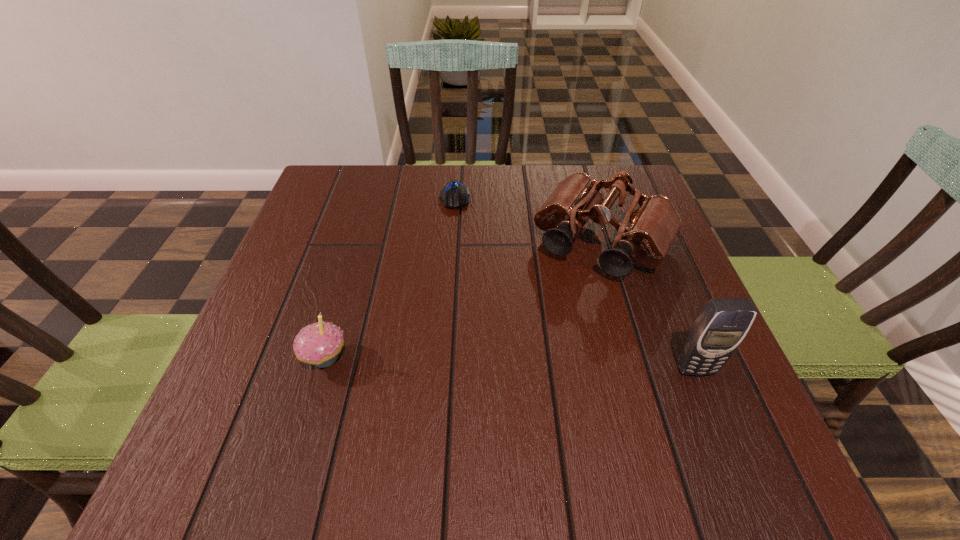
You are a GUI agent. You are given a task and a screenshot of the screen. Output one action in this format:
    pyautogui.click(x=<x>, y=<y>)
    Task: Click on the binoculars that is at the right edge
    This screenshot has height=540, width=960.
    Given the screenshot: What is the action you would take?
    pyautogui.click(x=650, y=225)

Locate an element on the screen. object at the near left corner is located at coordinates (319, 344).

Find the location of a particular element. The image size is (960, 540). object present at the far right corner is located at coordinates (650, 225).

Where is `object that is at the near right corner`? The width and height of the screenshot is (960, 540). object that is at the near right corner is located at coordinates (723, 323).

At what (x,y) coordinates should I click in order to perform the action: click on vacant region at the far edge of the desktop. Please return your answer as a coordinate pair (x, y). Looking at the image, I should click on (390, 177).

The width and height of the screenshot is (960, 540). Identify the location of vacant space at the near edge of the desktop. (634, 382).

The width and height of the screenshot is (960, 540). What are the coordinates of `vacant space at the left edge` in the screenshot? It's located at (330, 294).

At what (x,y) coordinates should I click in order to perform the action: click on vacant space at the right edge of the desktop. Please return your answer as a coordinate pair (x, y). This screenshot has width=960, height=540. Looking at the image, I should click on (610, 230).

This screenshot has width=960, height=540. Identify the location of free location at the far left corner. (331, 171).

Image resolution: width=960 pixels, height=540 pixels. In order to click on vacant space at the near left corner in this screenshot , I will do `click(279, 382)`.